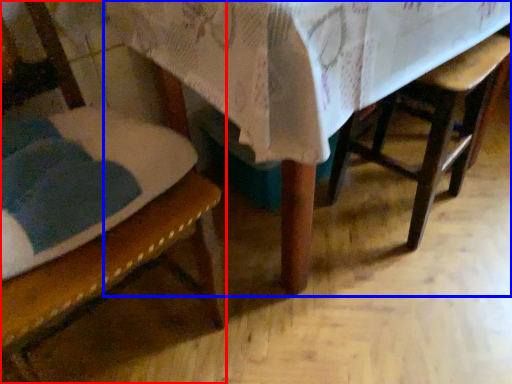
Question: Which object appears closest to the camera in this image, chair (highlighted by a red box) or table (highlighted by a blue box)?

Choices:
 (A) chair
 (B) table

Answer: (A)